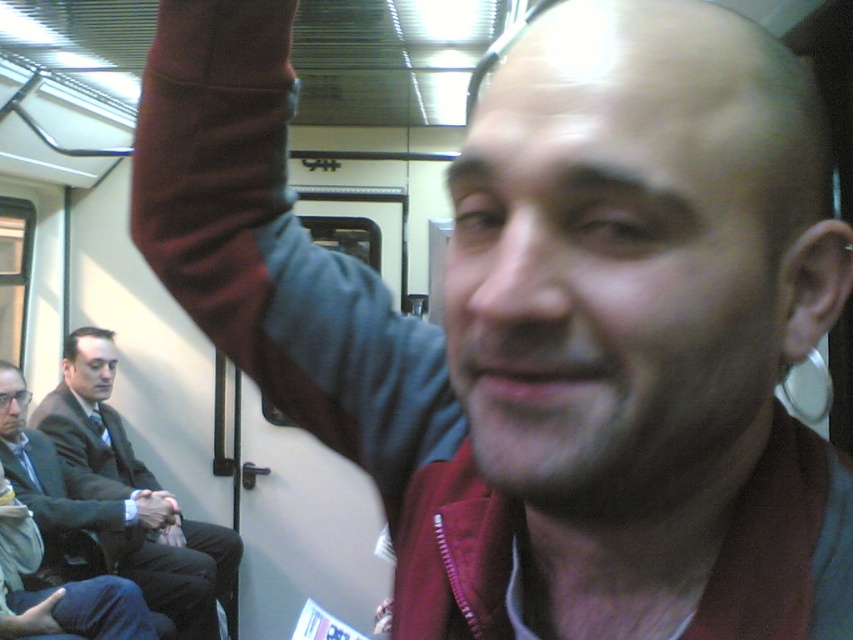
You are a passenger on a train and want to place a 12 inch long backpack on the floor between your seat and the maroon fabric arm at upper left. Is there enough space?

The maroon fabric arm at upper left is 19.13 inches from the camera, so there is sufficient space to place a 12 inch long backpack between your seat and the maroon fabric arm at upper left.

You are a passenger in a train car and want to place your matte black glasses at left on the seat next to you. There is a matte gray hand at lower left that belongs to another passenger. Can you safely place your glasses there without touching the other passenger?

The matte black glasses at left and matte gray hand at lower left are 20.26 inches apart, so yes, you can safely place your glasses there as the distance is sufficient to avoid touching the other passenger.

You are trying to place the matte black glasses at left on the matte gray hand at lower left. Will the glasses fit on the hand?

The matte black glasses at left are narrower than the matte gray hand at lower left, so they can fit on the hand.